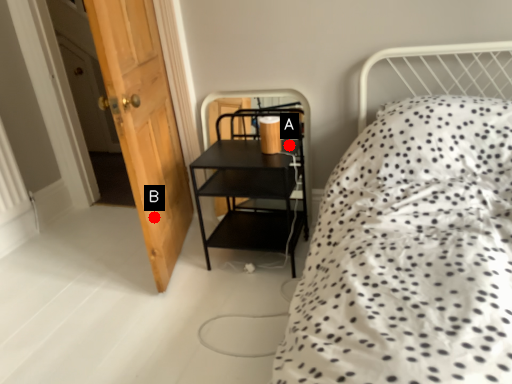
Question: Two points are circled on the image, labeled by A and B beside each circle. Which point is farther to the camera?

Choices:
 (A) A is further
 (B) B is further

Answer: (A)